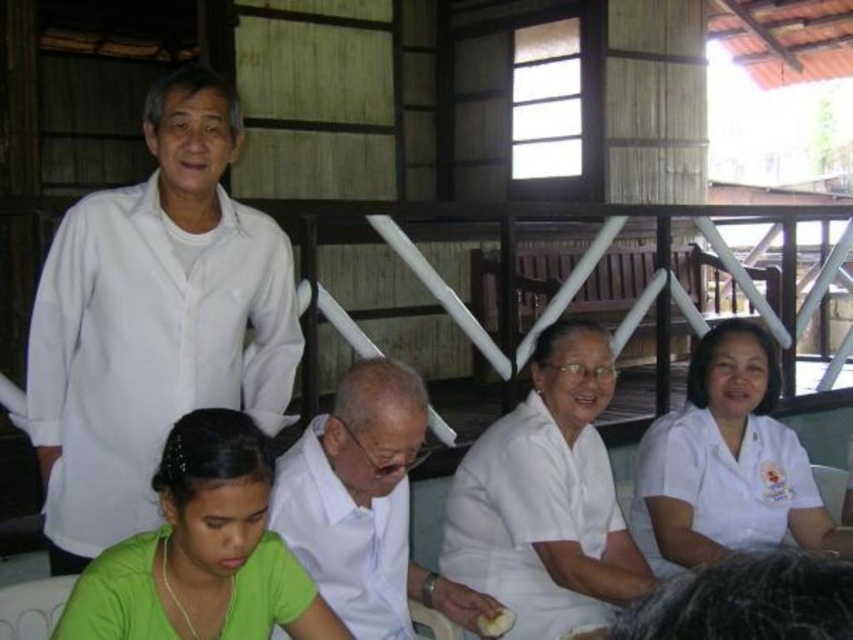
Question: Which of the following is the farthest from the observer?

Choices:
 (A) white matte shirt at upper left
 (B) white matte bread at lower center
 (C) white glossy shirt at center
 (D) green matte shirt at lower left

Answer: (B)

Question: Estimate the real-world distances between objects in this image. Which object is closer to the white glossy shirt at center?

Choices:
 (A) white matte shirt at upper left
 (B) green matte shirt at lower left
 (C) white smooth uniform at lower right

Answer: (B)

Question: Which object is positioned closest to the white matte shirt at upper left?

Choices:
 (A) green matte shirt at lower left
 (B) white matte shirt at center
 (C) white matte bread at lower center
 (D) white smooth uniform at lower right

Answer: (A)

Question: Can you confirm if white matte shirt at center is wider than green matte shirt at lower left?

Choices:
 (A) yes
 (B) no

Answer: (A)

Question: Does white glossy shirt at center have a lesser width compared to white matte bread at lower center?

Choices:
 (A) yes
 (B) no

Answer: (B)

Question: Can you confirm if white matte shirt at upper left is positioned to the right of white matte shirt at center?

Choices:
 (A) yes
 (B) no

Answer: (B)